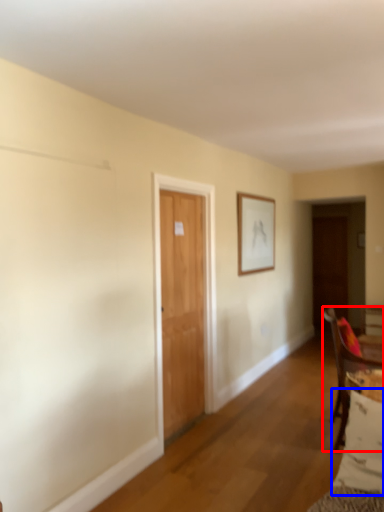
Question: Which point is closer to the camera, chair (highlighted by a red box) or pillow (highlighted by a blue box)?

Choices:
 (A) chair
 (B) pillow

Answer: (B)